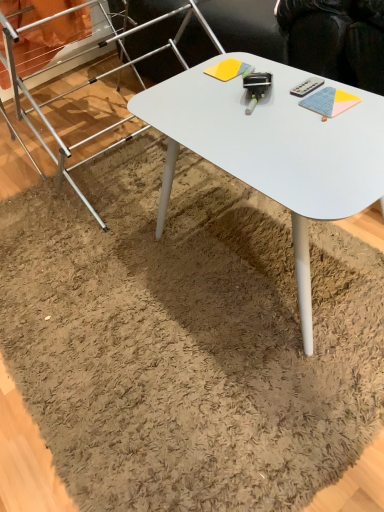
Locate an element on the screen. Image resolution: width=384 pixels, height=512 pixels. vacant area that is in front of black plastic remote control at upper right is located at coordinates (321, 122).